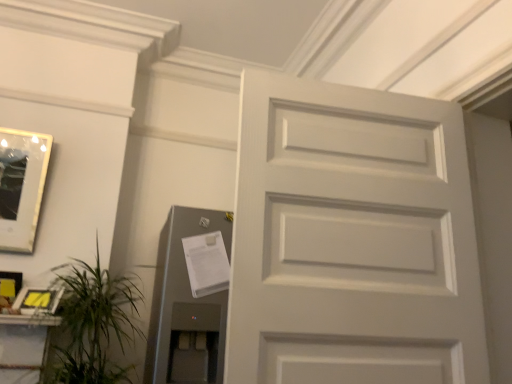
This screenshot has width=512, height=384. Describe the element at coordinates (38, 300) in the screenshot. I see `matte silver picture frame at lower left, the 3th picture frame from the top` at that location.

Where is `green leafy plant at lower left`? This screenshot has width=512, height=384. green leafy plant at lower left is located at coordinates (92, 324).

Where is `metallic gray elevator at lower left`? metallic gray elevator at lower left is located at coordinates point(187,303).

Image resolution: width=512 pixels, height=384 pixels. What do you see at coordinates (21, 186) in the screenshot? I see `matte silver picture frame at upper left, placed as the 1th picture frame when sorted from top to bottom` at bounding box center [21, 186].

This screenshot has height=384, width=512. I want to click on matte silver picture frame at lower left, positioned as the first picture frame in bottom-to-top order, so click(x=38, y=300).

Does point (339, 262) lie in front of point (39, 180)?

Yes.

Is matte silver picture frame at upper left, placed as the 1th picture frame when sorted from top to bottom, located within white matte door at center?

Definitely not — matte silver picture frame at upper left, placed as the 1th picture frame when sorted from top to bottom, is not inside white matte door at center.

Can you confirm if white matte door at center is wider than matte silver picture frame at upper left, placed as the 1th picture frame when sorted from top to bottom?

Indeed, white matte door at center has a greater width compared to matte silver picture frame at upper left, placed as the 1th picture frame when sorted from top to bottom.

Measure the distance between white matte door at center and matte silver picture frame at upper left, arranged as the third picture frame when ordered from the bottom.

white matte door at center is 1.75 meters away from matte silver picture frame at upper left, arranged as the third picture frame when ordered from the bottom.

Where is `the 2nd picture frame behind the green leafy plant at lower left`? This screenshot has width=512, height=384. the 2nd picture frame behind the green leafy plant at lower left is located at coordinates (9, 288).

From a real-world perspective, which is physically above, green leafy plant at lower left or matte black picture frame at lower left, the second picture frame positioned from the top?

In real-world perspective, matte black picture frame at lower left, the second picture frame positioned from the top, is above.

Is green leafy plant at lower left outside of matte black picture frame at lower left, which appears as the second picture frame when ordered from the bottom?

Yes.

Can you confirm if green leafy plant at lower left is shorter than matte black picture frame at lower left, the second picture frame positioned from the top?

No, green leafy plant at lower left is not shorter than matte black picture frame at lower left, the second picture frame positioned from the top.

Between matte black picture frame at lower left, the second picture frame positioned from the top, and white matte door at center, which one appears on the left side from the viewer's perspective?

From the viewer's perspective, matte black picture frame at lower left, the second picture frame positioned from the top, appears more on the left side.

From a real-world perspective, is matte black picture frame at lower left, the second picture frame positioned from the top, physically below white matte door at center?

Yes, from a real-world perspective, matte black picture frame at lower left, the second picture frame positioned from the top, is beneath white matte door at center.

This screenshot has width=512, height=384. What are the coordinates of `door above the matte black picture frame at lower left, the second picture frame positioned from the top (from a real-world perspective)` in the screenshot? It's located at (352, 239).

From the image's perspective, which one is positioned lower, matte silver picture frame at lower left, positioned as the first picture frame in bottom-to-top order, or white matte door at center?

matte silver picture frame at lower left, positioned as the first picture frame in bottom-to-top order.

How different are the orientations of matte silver picture frame at lower left, the 3th picture frame from the top, and white matte door at center in degrees?

There is a 18.6-degree angle between the facing directions of matte silver picture frame at lower left, the 3th picture frame from the top, and white matte door at center.

From the picture: Is matte silver picture frame at lower left, the 3th picture frame from the top, taller than white matte door at center?

No.

Considering the positions of point (5, 129) and point (4, 292), is point (5, 129) closer or farther from the camera than point (4, 292)?

Clearly, point (5, 129) is more distant from the camera than point (4, 292).

The height and width of the screenshot is (384, 512). What are the coordinates of `picture frame above the matte black picture frame at lower left, the second picture frame positioned from the top (from the image's perspective)` in the screenshot? It's located at (21, 186).

Considering the relative positions of matte silver picture frame at upper left, arranged as the third picture frame when ordered from the bottom, and matte black picture frame at lower left, which appears as the second picture frame when ordered from the bottom, in the image provided, is matte silver picture frame at upper left, arranged as the third picture frame when ordered from the bottom, behind matte black picture frame at lower left, which appears as the second picture frame when ordered from the bottom,?

Yes, matte silver picture frame at upper left, arranged as the third picture frame when ordered from the bottom, is further from the viewer.

How different are the orientations of matte silver picture frame at upper left, arranged as the third picture frame when ordered from the bottom, and matte black picture frame at lower left, the second picture frame positioned from the top, in degrees?

3.89 degrees separate the facing orientations of matte silver picture frame at upper left, arranged as the third picture frame when ordered from the bottom, and matte black picture frame at lower left, the second picture frame positioned from the top.

From a real-world perspective, who is located higher, green leafy plant at lower left or matte silver picture frame at upper left, placed as the 1th picture frame when sorted from top to bottom?

In real-world perspective, matte silver picture frame at upper left, placed as the 1th picture frame when sorted from top to bottom, is above.

In the scene shown: Between green leafy plant at lower left and matte silver picture frame at upper left, arranged as the third picture frame when ordered from the bottom, which one appears on the left side from the viewer's perspective?

From the viewer's perspective, matte silver picture frame at upper left, arranged as the third picture frame when ordered from the bottom, appears more on the left side.

Is green leafy plant at lower left taller than matte silver picture frame at upper left, arranged as the third picture frame when ordered from the bottom?

In fact, green leafy plant at lower left may be shorter than matte silver picture frame at upper left, arranged as the third picture frame when ordered from the bottom.

From the image's perspective, relative to matte silver picture frame at upper left, placed as the 1th picture frame when sorted from top to bottom, is green leafy plant at lower left above or below?

green leafy plant at lower left is situated lower than matte silver picture frame at upper left, placed as the 1th picture frame when sorted from top to bottom, in the image.

From the picture: Could you measure the distance between metallic gray elevator at lower left and matte silver picture frame at upper left, placed as the 1th picture frame when sorted from top to bottom?

metallic gray elevator at lower left and matte silver picture frame at upper left, placed as the 1th picture frame when sorted from top to bottom, are 36.19 inches apart from each other.

Which of these two, metallic gray elevator at lower left or matte silver picture frame at upper left, placed as the 1th picture frame when sorted from top to bottom, is wider?

With larger width is metallic gray elevator at lower left.

Can you tell me how much metallic gray elevator at lower left and matte silver picture frame at upper left, placed as the 1th picture frame when sorted from top to bottom, differ in facing direction?

The angle between the facing direction of metallic gray elevator at lower left and the facing direction of matte silver picture frame at upper left, placed as the 1th picture frame when sorted from top to bottom, is 0.64 degrees.

Would you say metallic gray elevator at lower left is outside matte silver picture frame at upper left, arranged as the third picture frame when ordered from the bottom?

Yes, metallic gray elevator at lower left is not within matte silver picture frame at upper left, arranged as the third picture frame when ordered from the bottom.

Find the location of a particular element. door that is below the matte silver picture frame at upper left, arranged as the third picture frame when ordered from the bottom (from the image's perspective) is located at coordinates (352, 239).

Find the location of a particular element. The image size is (512, 384). houseplant in front of the matte black picture frame at lower left, the second picture frame positioned from the top is located at coordinates (92, 324).

Estimate the real-world distances between objects in this image. Which object is closer to matte silver picture frame at lower left, the 3th picture frame from the top, metallic gray elevator at lower left or matte silver picture frame at upper left, placed as the 1th picture frame when sorted from top to bottom?

The object closer to matte silver picture frame at lower left, the 3th picture frame from the top, is matte silver picture frame at upper left, placed as the 1th picture frame when sorted from top to bottom.

From the image, which object appears to be farther from matte silver picture frame at upper left, placed as the 1th picture frame when sorted from top to bottom, matte black picture frame at lower left, which appears as the second picture frame when ordered from the bottom, or metallic gray elevator at lower left?

metallic gray elevator at lower left is positioned further to the anchor matte silver picture frame at upper left, placed as the 1th picture frame when sorted from top to bottom.

When comparing their distances from white matte door at center, does green leafy plant at lower left or matte black picture frame at lower left, which appears as the second picture frame when ordered from the bottom, seem closer?

green leafy plant at lower left is closer to white matte door at center.

Looking at the image, which one is located closer to metallic gray elevator at lower left, matte silver picture frame at lower left, positioned as the first picture frame in bottom-to-top order, or white matte door at center?

matte silver picture frame at lower left, positioned as the first picture frame in bottom-to-top order, lies closer to metallic gray elevator at lower left than the other object.

Looking at the image, which one is located closer to green leafy plant at lower left, matte silver picture frame at upper left, placed as the 1th picture frame when sorted from top to bottom, or matte silver picture frame at lower left, positioned as the first picture frame in bottom-to-top order?

matte silver picture frame at lower left, positioned as the first picture frame in bottom-to-top order, lies closer to green leafy plant at lower left than the other object.

From the image, which object appears to be farther from metallic gray elevator at lower left, matte silver picture frame at upper left, placed as the 1th picture frame when sorted from top to bottom, or matte black picture frame at lower left, which appears as the second picture frame when ordered from the bottom?

Among the two, matte silver picture frame at upper left, placed as the 1th picture frame when sorted from top to bottom, is located further to metallic gray elevator at lower left.

Considering their positions, is matte black picture frame at lower left, the second picture frame positioned from the top, positioned further to matte silver picture frame at upper left, placed as the 1th picture frame when sorted from top to bottom, than matte silver picture frame at lower left, positioned as the first picture frame in bottom-to-top order?

The object further to matte silver picture frame at upper left, placed as the 1th picture frame when sorted from top to bottom, is matte silver picture frame at lower left, positioned as the first picture frame in bottom-to-top order.

From the image, which object appears to be farther from metallic gray elevator at lower left, white matte door at center or green leafy plant at lower left?

white matte door at center lies further to metallic gray elevator at lower left than the other object.

This screenshot has width=512, height=384. I want to click on picture frame between matte black picture frame at lower left, the second picture frame positioned from the top, and white matte door at center, so click(38, 300).

Locate an element on the screen. The width and height of the screenshot is (512, 384). picture frame between matte black picture frame at lower left, the second picture frame positioned from the top, and metallic gray elevator at lower left from left to right is located at coordinates (38, 300).

You are a GUI agent. You are given a task and a screenshot of the screen. Output one action in this format:
    pyautogui.click(x=<x>, y=<y>)
    Task: Click on the houseplant situated between matte black picture frame at lower left, which appears as the second picture frame when ordered from the bottom, and metallic gray elevator at lower left from left to right
    
    Given the screenshot: What is the action you would take?
    pyautogui.click(x=92, y=324)

The height and width of the screenshot is (384, 512). I want to click on picture frame between matte silver picture frame at upper left, arranged as the third picture frame when ordered from the bottom, and matte silver picture frame at lower left, the 3th picture frame from the top, vertically, so click(x=9, y=288).